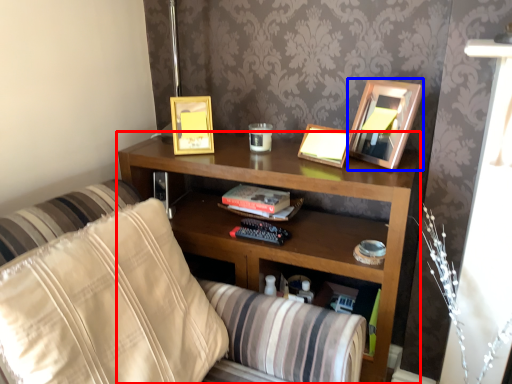
Question: Which object appears farthest to the camera in this image, shelf (highlighted by a red box) or picture frame (highlighted by a blue box)?

Choices:
 (A) shelf
 (B) picture frame

Answer: (B)